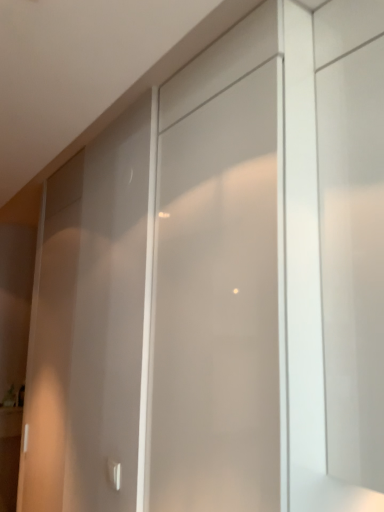
Question: Considering the relative sizes of white glossy door handle at lower left and frosted glass screen door at center in the image provided, is white glossy door handle at lower left bigger than frosted glass screen door at center?

Choices:
 (A) no
 (B) yes

Answer: (A)

Question: Is white glossy door handle at lower left wider than frosted glass screen door at center?

Choices:
 (A) no
 (B) yes

Answer: (A)

Question: Does white glossy door handle at lower left have a lesser width compared to frosted glass screen door at center?

Choices:
 (A) yes
 (B) no

Answer: (A)

Question: Is white glossy door handle at lower left at the right side of frosted glass screen door at center?

Choices:
 (A) no
 (B) yes

Answer: (A)

Question: Is white glossy door handle at lower left taller than frosted glass screen door at center?

Choices:
 (A) yes
 (B) no

Answer: (B)

Question: From the image's perspective, is white glossy door handle at lower left under frosted glass screen door at center?

Choices:
 (A) yes
 (B) no

Answer: (A)

Question: From a real-world perspective, is frosted glass screen door at center physically below white glossy door handle at lower left?

Choices:
 (A) no
 (B) yes

Answer: (A)

Question: Is frosted glass screen door at center shorter than white glossy door handle at lower left?

Choices:
 (A) no
 (B) yes

Answer: (A)

Question: Does frosted glass screen door at center have a smaller size compared to white glossy door handle at lower left?

Choices:
 (A) no
 (B) yes

Answer: (A)

Question: From the image's perspective, is frosted glass screen door at center above white glossy door handle at lower left?

Choices:
 (A) yes
 (B) no

Answer: (A)

Question: Considering the relative positions of frosted glass screen door at center and white glossy door handle at lower left in the image provided, is frosted glass screen door at center to the left of white glossy door handle at lower left from the viewer's perspective?

Choices:
 (A) no
 (B) yes

Answer: (A)

Question: Can you confirm if frosted glass screen door at center is positioned to the right of white glossy door handle at lower left?

Choices:
 (A) no
 (B) yes

Answer: (B)

Question: Considering the positions of frosted glass screen door at center and white glossy door handle at lower left in the image, is frosted glass screen door at center taller or shorter than white glossy door handle at lower left?

Choices:
 (A) short
 (B) tall

Answer: (B)